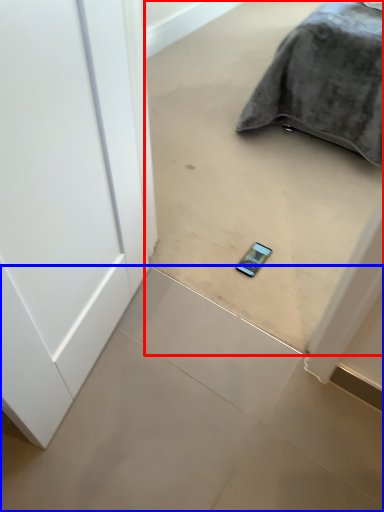
Question: Which object appears closest to the camera in this image, concrete (highlighted by a red box) or concrete (highlighted by a blue box)?

Choices:
 (A) concrete
 (B) concrete

Answer: (A)